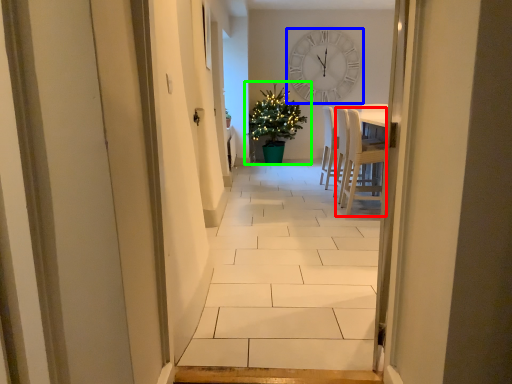
Question: Which object is positioned farthest from chair (highlighted by a red box)? Select from wall clock (highlighted by a blue box) and houseplant (highlighted by a green box).

Choices:
 (A) wall clock
 (B) houseplant

Answer: (A)